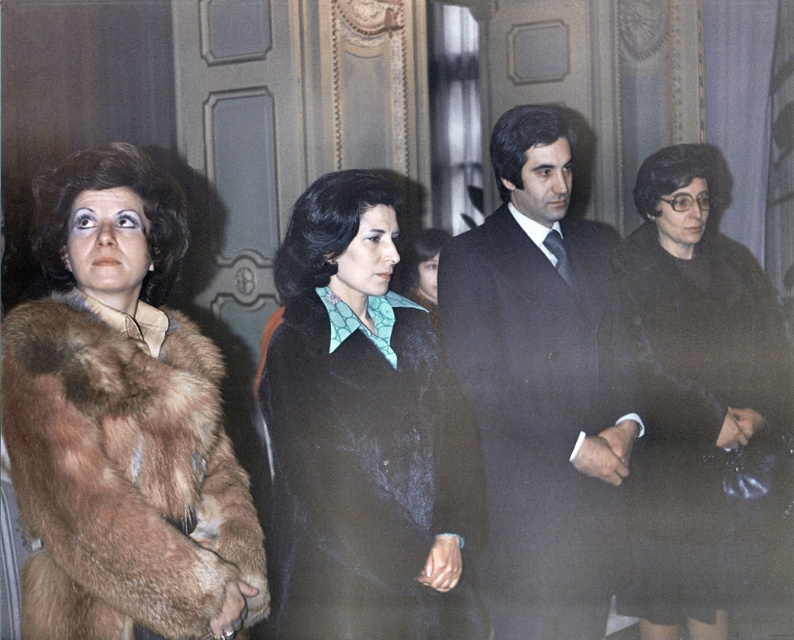
Question: Observing the image, what is the correct spatial positioning of brown fur coat at left in reference to velvet black coat at center?

Choices:
 (A) left
 (B) right

Answer: (A)

Question: Which of the following is the closest to the observer?

Choices:
 (A) black wool coat at center
 (B) velvet teal blouse at center
 (C) brown fur coat at left

Answer: (C)

Question: Can you confirm if velvet black coat at center is positioned to the right of velvet teal blouse at center?

Choices:
 (A) no
 (B) yes

Answer: (A)

Question: Does brown fur coat at left have a larger size compared to black wool coat at center?

Choices:
 (A) no
 (B) yes

Answer: (A)

Question: Among these objects, which one is nearest to the camera?

Choices:
 (A) brown fur coat at left
 (B) velvet black coat at center
 (C) black wool coat at center

Answer: (A)

Question: Which object is positioned closest to the dark suit at center?

Choices:
 (A) black wool coat at center
 (B) velvet black coat at center

Answer: (B)